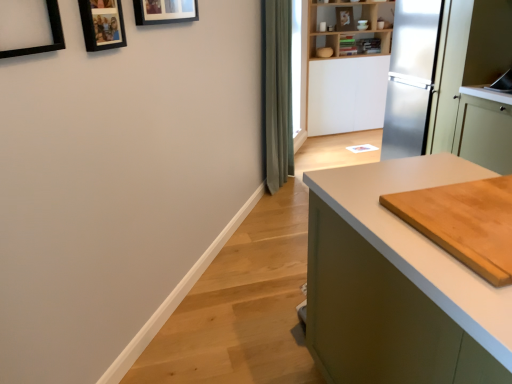
In order to face green fabric curtain at center, should I rotate leftwards or rightwards?

To face it directly, rotate right by 3.599 degrees.

The width and height of the screenshot is (512, 384). What are the coordinates of `wooden picture frame at upper center, acting as the third picture frame starting from the front` in the screenshot? It's located at (165, 11).

Describe the element at coordinates (102, 24) in the screenshot. I see `wooden photo frame at upper left, which appears as the 2th picture frame when viewed from the left` at that location.

I want to click on wooden bookshelf at upper center, so click(x=347, y=25).

Considering the positions of objects wooden photo frame at upper left, acting as the second picture frame starting from the back, and wooden bookshelf at upper center in the image provided, who is more to the right, wooden photo frame at upper left, acting as the second picture frame starting from the back, or wooden bookshelf at upper center?

wooden bookshelf at upper center.

From the image's perspective, is wooden photo frame at upper left, which appears as the 2th picture frame when viewed from the left, above or below wooden bookshelf at upper center?

Clearly, from the image's perspective, wooden photo frame at upper left, which appears as the 2th picture frame when viewed from the left, is below wooden bookshelf at upper center.

At what (x,y) coordinates should I click in order to perform the action: click on shelf lying above the wooden photo frame at upper left, positioned as the 2th picture frame in right-to-left order (from the image's perspective). Please return your answer as a coordinate pair (x, y). The width and height of the screenshot is (512, 384). Looking at the image, I should click on (347, 25).

What's the angular difference between wooden photo frame at upper left, which appears as the 2th picture frame when viewed from the left, and wooden bookshelf at upper center's facing directions?

56.5 degrees.

Is wooden bookshelf at upper center not within matte gray countertop at center?

wooden bookshelf at upper center is positioned outside matte gray countertop at center.

Does wooden bookshelf at upper center appear on the left side of matte gray countertop at center?

In fact, wooden bookshelf at upper center is to the right of matte gray countertop at center.

Does point (366, 8) appear closer or farther from the camera than point (386, 327)?

Point (366, 8) appears to be farther away from the viewer than point (386, 327).

This screenshot has height=384, width=512. I want to click on shelf on the right of the matte gray countertop at center, so click(x=347, y=25).

From a real-world perspective, between wooden bookshelf at upper center and black matte picture frame at upper left, the 3th picture frame positioned from the right, who is vertically higher?

black matte picture frame at upper left, the 3th picture frame positioned from the right, from a real-world perspective.

Is point (379, 39) less distant than point (63, 37)?

That is False.

Is wooden bookshelf at upper center not within black matte picture frame at upper left, the 1th picture frame positioned from the left?

Yes.

Between wooden picture frame at upper center, acting as the first picture frame starting from the back, and matte gray countertop at center, which one has less height?

wooden picture frame at upper center, acting as the first picture frame starting from the back.

Is wooden picture frame at upper center, the third picture frame positioned from the left, spatially inside matte gray countertop at center, or outside of it?

wooden picture frame at upper center, the third picture frame positioned from the left, is not inside matte gray countertop at center, it's outside.

Is wooden picture frame at upper center, acting as the third picture frame starting from the front, facing away from matte gray countertop at center?

wooden picture frame at upper center, acting as the third picture frame starting from the front, is not turned away from matte gray countertop at center.

Which point is more forward, (147, 15) or (388, 225)?

Positioned in front is point (388, 225).

From a real-world perspective, who is located lower, light brown wooden cutting board at right or black matte picture frame at upper left, the 1th picture frame positioned from the left?

In real-world perspective, light brown wooden cutting board at right is lower.

Find the location of a particular element. Image resolution: width=512 pixels, height=384 pixels. cutting board below the black matte picture frame at upper left, the 3th picture frame positioned from the right (from a real-world perspective) is located at coordinates (464, 222).

Is light brown wooden cutting board at right facing away from black matte picture frame at upper left, the 3th picture frame positioned from the right?

No, light brown wooden cutting board at right is not facing the opposite direction of black matte picture frame at upper left, the 3th picture frame positioned from the right.

Is wooden picture frame at upper center, acting as the third picture frame starting from the front, closer to the viewer compared to wooden cutting board at right?

Yes, it is.

Would you say wooden picture frame at upper center, acting as the third picture frame starting from the front, is to the left or to the right of wooden cutting board at right in the picture?

Based on their positions, wooden picture frame at upper center, acting as the third picture frame starting from the front, is located to the left of wooden cutting board at right.

Considering the points (170, 22) and (496, 147), which point is in front, point (170, 22) or point (496, 147)?

The point (170, 22) is in front.

The height and width of the screenshot is (384, 512). Find the location of `cabinetry that is below the wooden picture frame at upper center, the third picture frame positioned from the left (from the image's perspective)`. cabinetry that is below the wooden picture frame at upper center, the third picture frame positioned from the left (from the image's perspective) is located at coordinates (484, 129).

Can you confirm if black matte picture frame at upper left, the 3th picture frame positioned from the right, is wider than matte gray countertop at center?

In fact, black matte picture frame at upper left, the 3th picture frame positioned from the right, might be narrower than matte gray countertop at center.

Which is farther, [63,38] or [431,298]?

The point [63,38] is behind.

Considering their positions, is black matte picture frame at upper left, which ranks as the third picture frame in back-to-front order, located in front of or behind matte gray countertop at center?

Visually, black matte picture frame at upper left, which ranks as the third picture frame in back-to-front order, is located behind matte gray countertop at center.

Identify the location of the 2nd picture frame below when counting from the wooden bookshelf at upper center (from the image's perspective). (102, 24).

Where is `countertop on the left of the wooden bookshelf at upper center`? countertop on the left of the wooden bookshelf at upper center is located at coordinates (397, 284).

Based on their spatial positions, is green fabric curtain at center or black matte picture frame at upper left, the 1th picture frame positioned from the left, closer to wooden cutting board at right?

green fabric curtain at center lies closer to wooden cutting board at right than the other object.

Which object lies nearer to the anchor point wooden picture frame at upper center, acting as the third picture frame starting from the front, light brown wooden cutting board at right or green fabric curtain at center?

light brown wooden cutting board at right.

Consider the image. Which object lies nearer to the anchor point wooden cutting board at right, wooden picture frame at upper center, acting as the first picture frame starting from the back, or green fabric curtain at center?

Based on the image, green fabric curtain at center appears to be nearer to wooden cutting board at right.

Based on their spatial positions, is wooden bookshelf at upper center or wooden picture frame at upper center, which is the first picture frame from right to left, closer to green fabric curtain at center?

The object closer to green fabric curtain at center is wooden picture frame at upper center, which is the first picture frame from right to left.

From the picture: From the image, which object appears to be nearer to wooden cutting board at right, wooden photo frame at upper left, acting as the second picture frame starting from the back, or wooden bookshelf at upper center?

wooden bookshelf at upper center is positioned closer to the anchor wooden cutting board at right.

Looking at the image, which one is located further to wooden bookshelf at upper center, wooden picture frame at upper center, acting as the third picture frame starting from the front, or light brown wooden cutting board at right?

light brown wooden cutting board at right.

Estimate the real-world distances between objects in this image. Which object is closer to wooden bookshelf at upper center, light brown wooden cutting board at right or black matte picture frame at upper left, which ranks as the third picture frame in back-to-front order?

The object closer to wooden bookshelf at upper center is light brown wooden cutting board at right.

Looking at the image, which one is located closer to light brown wooden cutting board at right, wooden bookshelf at upper center or wooden picture frame at upper center, the third picture frame positioned from the left?

The object closer to light brown wooden cutting board at right is wooden picture frame at upper center, the third picture frame positioned from the left.

The image size is (512, 384). I want to click on countertop between black matte picture frame at upper left, which ranks as the third picture frame in back-to-front order, and wooden cutting board at right from left to right, so click(x=397, y=284).

Find the location of a particular element. The width and height of the screenshot is (512, 384). cabinetry between light brown wooden cutting board at right and wooden bookshelf at upper center from front to back is located at coordinates (484, 129).

Identify the location of picture frame located between wooden photo frame at upper left, acting as the second picture frame starting from the back, and green fabric curtain at center in the depth direction. (165, 11).

The image size is (512, 384). I want to click on picture frame located between black matte picture frame at upper left, which is the first picture frame from front to back, and wooden picture frame at upper center, acting as the first picture frame starting from the back, in the depth direction, so [102, 24].